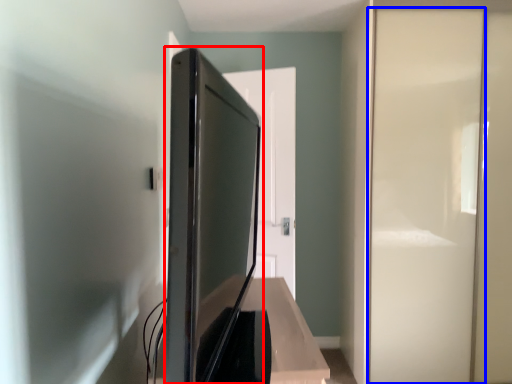
Question: Which point is further to the camera, appliance (highlighted by a red box) or screen door (highlighted by a blue box)?

Choices:
 (A) appliance
 (B) screen door

Answer: (B)